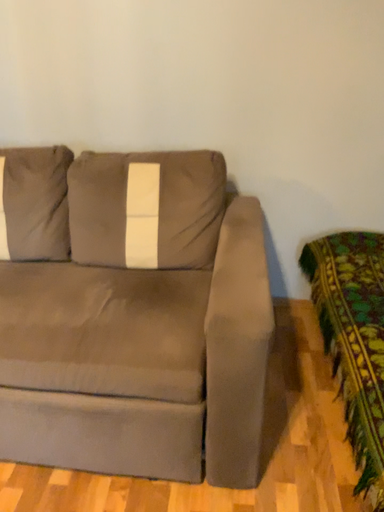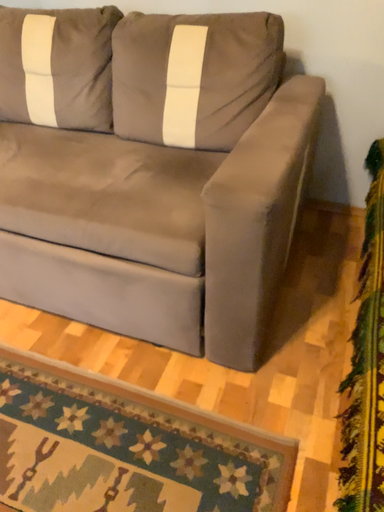
Question: How did the camera likely rotate when shooting the video?

Choices:
 (A) rotated right
 (B) rotated left

Answer: (B)